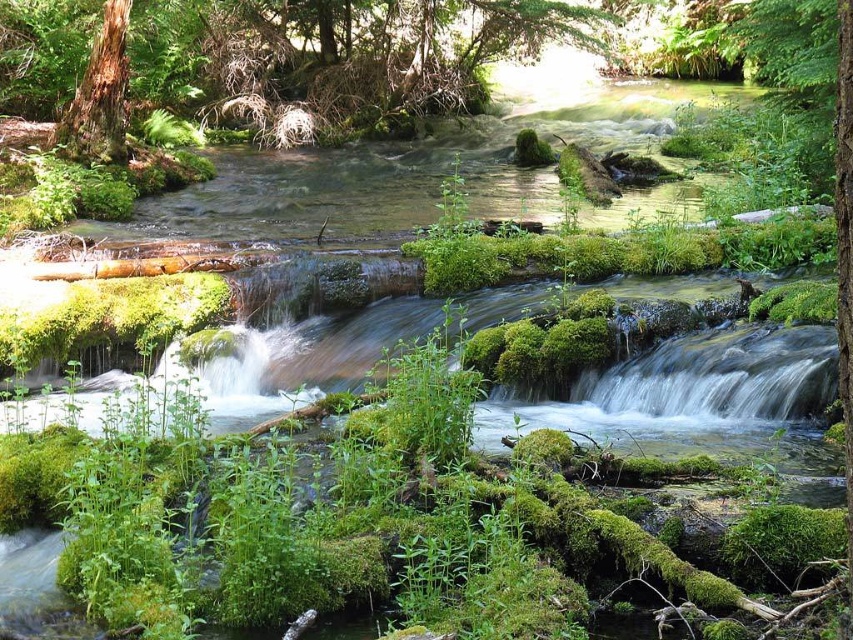
Can you confirm if smooth brown tree trunk at upper left is taller than brown textured tree trunk at upper left?

Indeed, smooth brown tree trunk at upper left has a greater height compared to brown textured tree trunk at upper left.

Could you measure the distance between smooth brown tree trunk at upper left and brown textured tree trunk at upper left?

A distance of 18.26 feet exists between smooth brown tree trunk at upper left and brown textured tree trunk at upper left.

Is point (323, 36) in front of point (114, 83)?

No, it is behind (114, 83).

The height and width of the screenshot is (640, 853). In order to click on smooth brown tree trunk at upper left in this screenshot , I will do `click(300, 61)`.